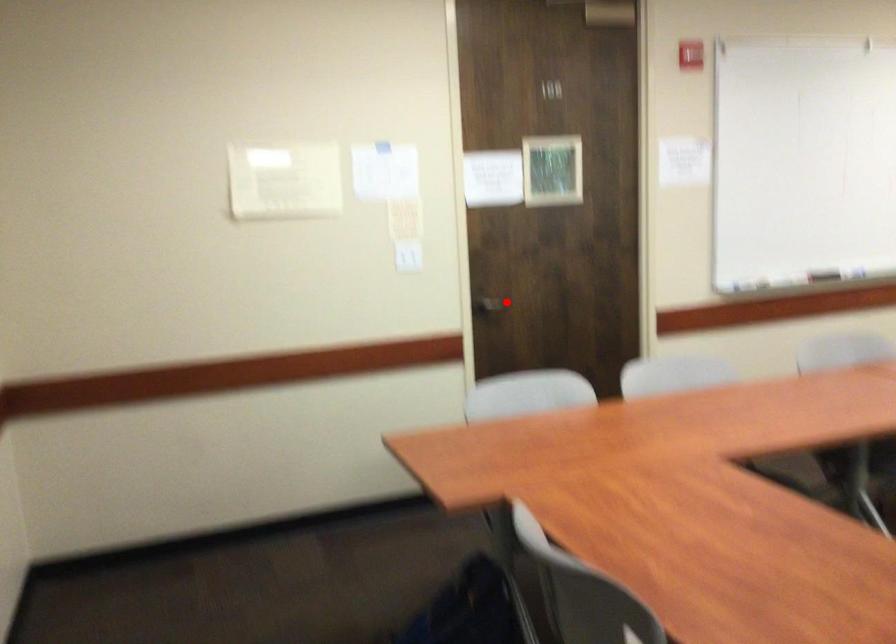
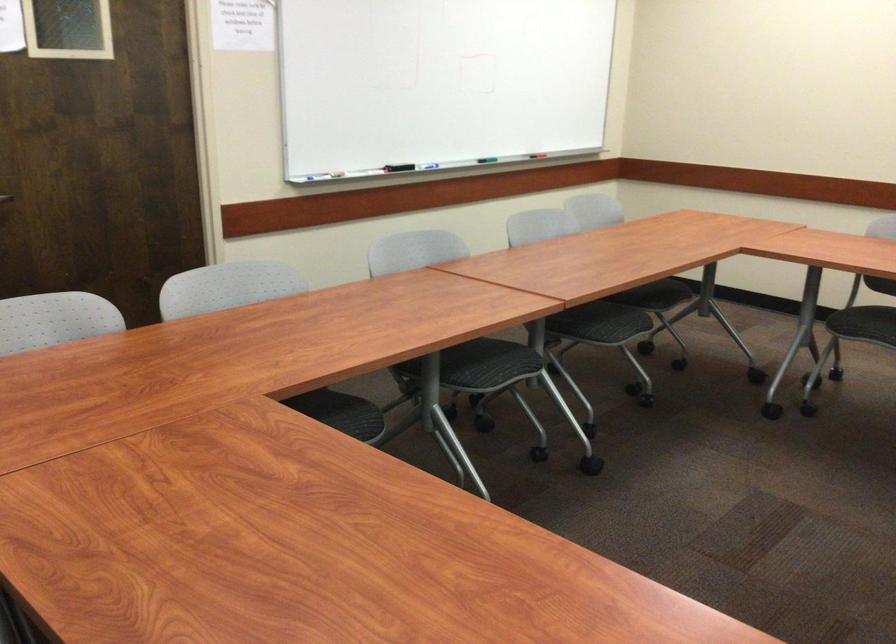
Locate, in the second image, the point that corresponds to the highlighted location in the first image.

(5, 198)